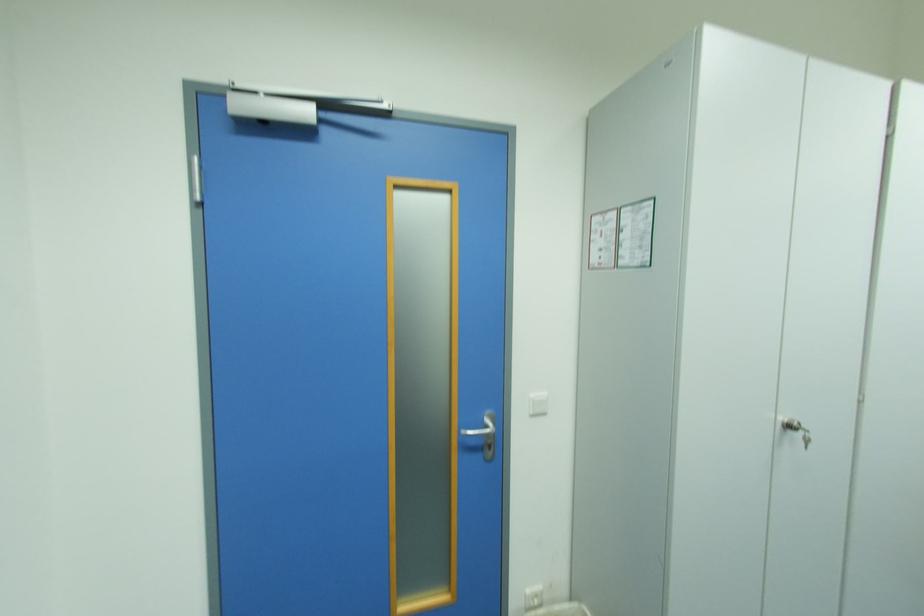
This screenshot has height=616, width=924. What do you see at coordinates (484, 435) in the screenshot?
I see `the silver door handle` at bounding box center [484, 435].